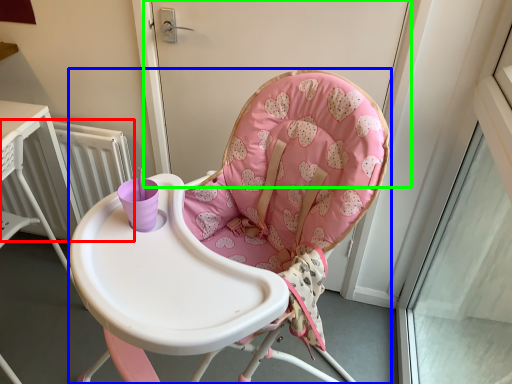
Question: Considering the real-world distances, which object is farthest from radiator (highlighted by a red box)? chair (highlighted by a blue box) or screen door (highlighted by a green box)?

Choices:
 (A) chair
 (B) screen door

Answer: (A)